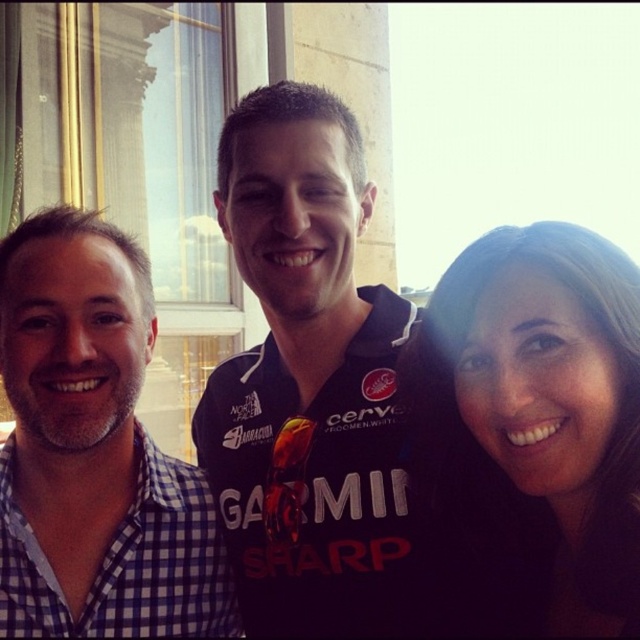
You are a photographer trying to adjust the lighting for the photo. You notice the dark blue jersey at center and the brown hair at center. Which object is positioned more to the left in the frame?

The dark blue jersey at center is positioned to the left of the brown hair at center.

What is the position of the dark blue jersey at center?

The dark blue jersey at center is located at point (310, 388).